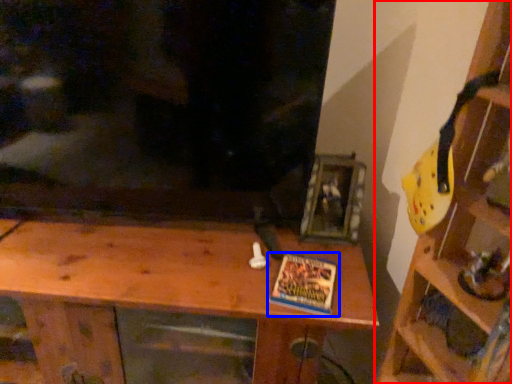
Question: Which object is further to the camera taking this photo, shelf (highlighted by a red box) or book (highlighted by a blue box)?

Choices:
 (A) shelf
 (B) book

Answer: (B)